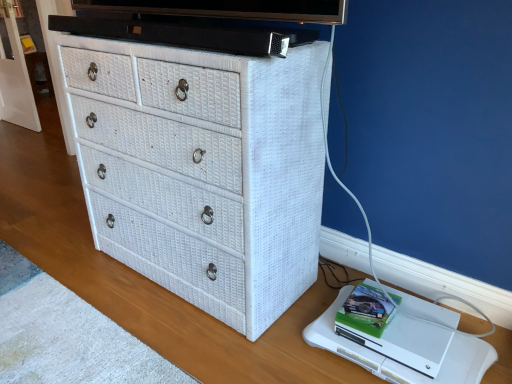
Question: In the image, is white matte xbox one at lower right on the left side or the right side of white wicker chest of drawers at center?

Choices:
 (A) right
 (B) left

Answer: (A)

Question: Does point (394, 324) appear closer or farther from the camera than point (126, 56)?

Choices:
 (A) closer
 (B) farther

Answer: (B)

Question: Is white matte xbox one at lower right bigger or smaller than white wicker chest of drawers at center?

Choices:
 (A) big
 (B) small

Answer: (B)

Question: From the image's perspective, is white wicker chest of drawers at center located above or below white matte xbox one at lower right?

Choices:
 (A) below
 (B) above

Answer: (B)

Question: Choose the correct answer: Is white wicker chest of drawers at center inside white matte xbox one at lower right or outside it?

Choices:
 (A) inside
 (B) outside

Answer: (B)

Question: Is white wicker chest of drawers at center bigger or smaller than white matte xbox one at lower right?

Choices:
 (A) big
 (B) small

Answer: (A)

Question: Considering their positions, is white wicker chest of drawers at center located in front of or behind white matte xbox one at lower right?

Choices:
 (A) behind
 (B) front

Answer: (B)